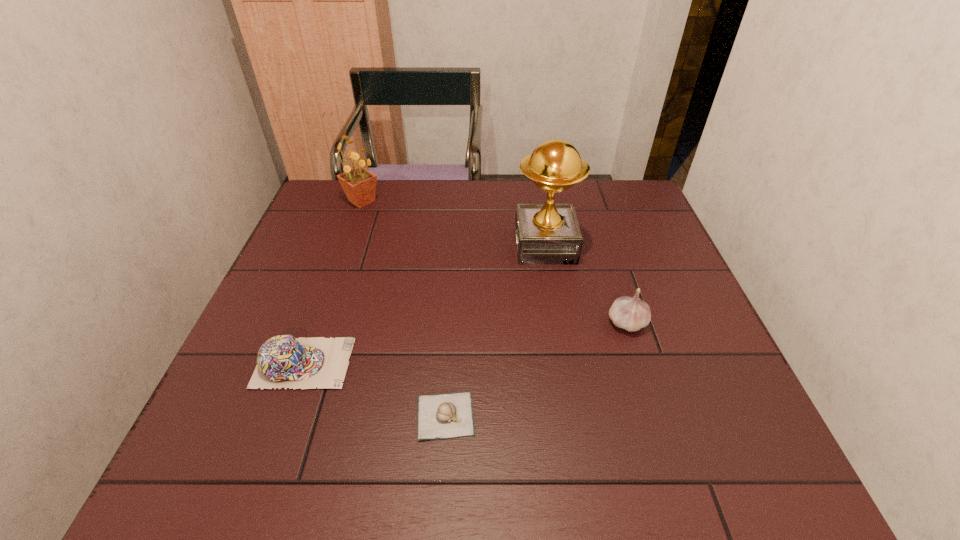
Locate an element on the screen. The image size is (960, 540). vacant region located 0.130m on the front-facing side of the tallest object is located at coordinates (468, 246).

Identify the location of free space located on the front-facing side of the tallest object. This screenshot has height=540, width=960. (407, 246).

In order to click on vacant region located on the front-facing side of the tallest object in this screenshot , I will do `click(439, 246)`.

Where is `blank space located 0.180m at the front of the second tallest object with flowers visible`? The height and width of the screenshot is (540, 960). blank space located 0.180m at the front of the second tallest object with flowers visible is located at coordinates (345, 249).

Image resolution: width=960 pixels, height=540 pixels. What are the coordinates of `vacant space situated on the left of the rightmost object` in the screenshot? It's located at (516, 323).

At what (x,y) coordinates should I click in order to perform the action: click on vacant position located 0.260m on the front, side, and top of the second shortest object. Please return your answer as a coordinate pair (x, y). This screenshot has width=960, height=540. Looking at the image, I should click on click(472, 363).

Locate an element on the screen. vacant point located 0.190m on the right of the shortest object is located at coordinates (574, 415).

Identify the location of object positioned at the far edge. (359, 184).

You are a GUI agent. You are given a task and a screenshot of the screen. Output one action in this format:
    pyautogui.click(x=<x>, y=<y>)
    Task: Click on the object present at the near edge
    The image size is (960, 540).
    Given the screenshot: What is the action you would take?
    pyautogui.click(x=450, y=415)

At what (x,y) coordinates should I click in order to perform the action: click on sunflower situated at the left edge. Please return your answer as a coordinate pair (x, y). The width and height of the screenshot is (960, 540). Looking at the image, I should click on (359, 184).